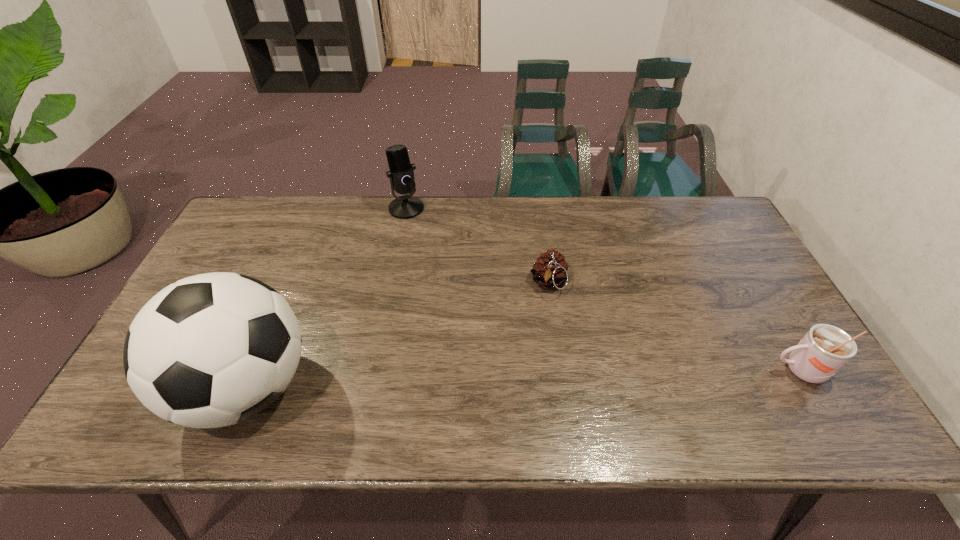
You are a GUI agent. You are given a task and a screenshot of the screen. Output one action in this format:
    pyautogui.click(x=<x>, y=<y>)
    Task: Click on the free space located on the side with the handle of the cup
    The image size is (960, 540).
    Given the screenshot: What is the action you would take?
    pyautogui.click(x=728, y=370)

Find the location of a particular element. This screenshot has width=960, height=540. vacant region located on the side with the handle of the cup is located at coordinates (616, 370).

This screenshot has width=960, height=540. I want to click on vacant space situated on the stand of the microphone, so click(x=413, y=228).

Where is `free space located on the stand of the microphone`? Image resolution: width=960 pixels, height=540 pixels. free space located on the stand of the microphone is located at coordinates (433, 282).

You are a GUI agent. You are given a task and a screenshot of the screen. Output one action in this format:
    pyautogui.click(x=<x>, y=<y>)
    Task: Click on the free space located 0.240m on the stand of the microphone
    This screenshot has height=540, width=960.
    Given the screenshot: What is the action you would take?
    pyautogui.click(x=427, y=266)

Image resolution: width=960 pixels, height=540 pixels. I want to click on vacant space located with a leaf charm attached to the third nearest object, so click(543, 344).

This screenshot has height=540, width=960. What are the coordinates of `vacant space situated 0.270m with a leaf charm attached to the third nearest object` in the screenshot? It's located at (539, 385).

Identify the location of vacant area situated with a leaf charm attached to the third nearest object. (544, 338).

Where is `object that is at the far edge`? object that is at the far edge is located at coordinates (401, 174).

The image size is (960, 540). What are the coordinates of `soccer ball that is at the near edge` in the screenshot? It's located at (211, 350).